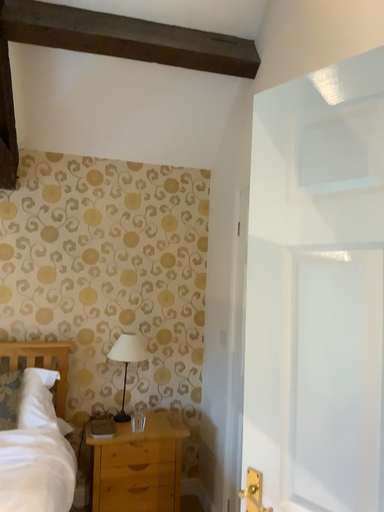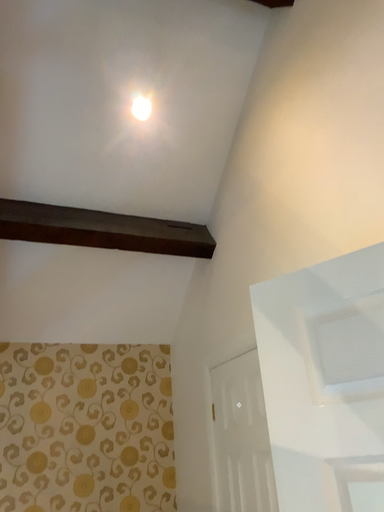
Question: Which way did the camera rotate in the video?

Choices:
 (A) rotated right
 (B) rotated left

Answer: (A)